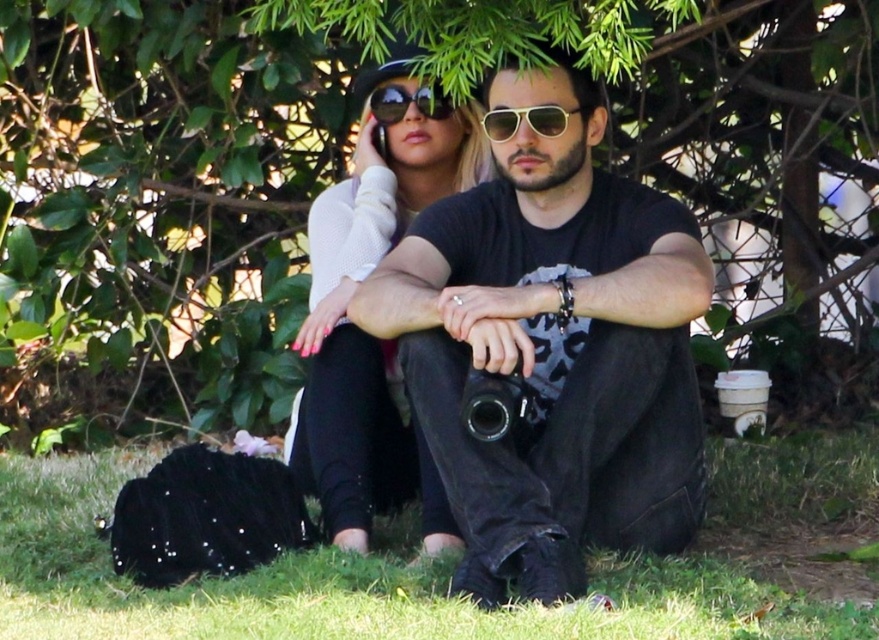
Question: Considering the real-world distances, which object is farthest from the shiny black sunglasses at center?

Choices:
 (A) green grass at lower center
 (B) black matte t-shirt at center
 (C) matte white sweater at center
 (D) gold reflective aviator sunglasses at center

Answer: (A)

Question: Can you confirm if green grass at lower center is positioned to the right of matte white sweater at center?

Choices:
 (A) no
 (B) yes

Answer: (A)

Question: Among these objects, which one is farthest from the camera?

Choices:
 (A) shiny black sunglasses at center
 (B) black matte t-shirt at center

Answer: (A)

Question: Can you confirm if black matte t-shirt at center is positioned to the right of gold reflective aviator sunglasses at center?

Choices:
 (A) no
 (B) yes

Answer: (B)

Question: Which object is closer to the camera taking this photo?

Choices:
 (A) gold reflective aviator sunglasses at center
 (B) black matte t-shirt at center
 (C) green leafy tree at upper center

Answer: (B)

Question: Is black matte t-shirt at center to the left of green grass at lower center from the viewer's perspective?

Choices:
 (A) no
 (B) yes

Answer: (A)